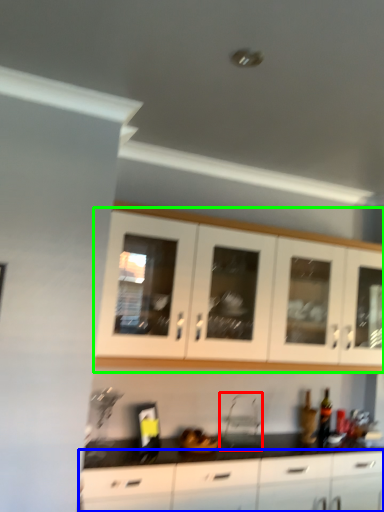
Question: Estimate the real-world distances between objects in this image. Which object is farther from appliance (highlighted by a red box), cabinetry (highlighted by a blue box) or cabinetry (highlighted by a green box)?

Choices:
 (A) cabinetry
 (B) cabinetry

Answer: (B)